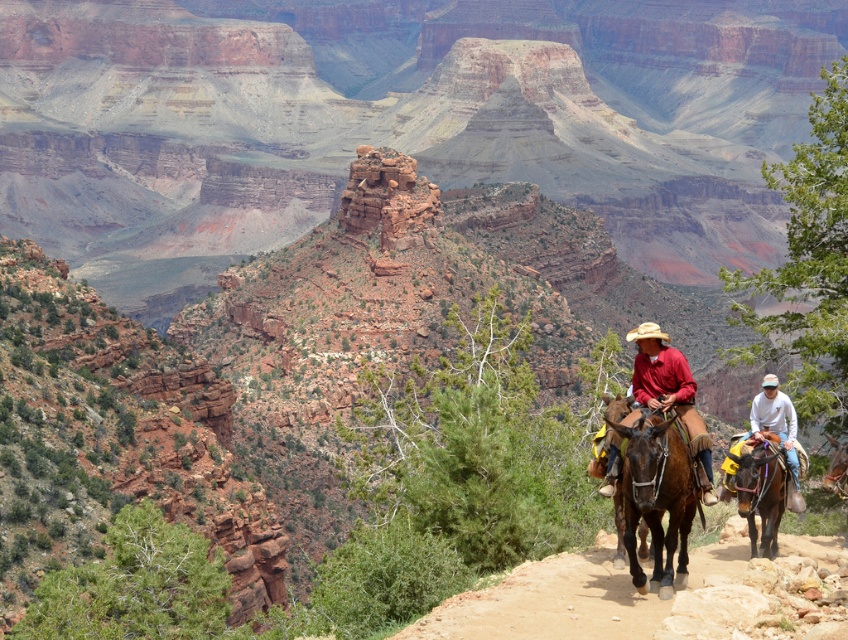
You are a photographer planning to take a portrait of both the matte red shirt at center and the white cotton shirt at upper right. Since you want to ensure both shirts are clearly visible, which one should you focus on first to capture their details properly?

The matte red shirt at center is larger in size than the white cotton shirt at upper right, so focusing on the matte red shirt at center first will help ensure its details are captured clearly before adjusting for the smaller white cotton shirt at upper right.

You are a photographer standing at the edge of the Grand Canyon. You see the brown glossy horse at center and the brown leather saddle at lower right in your viewfinder. Which object is closer to you, the photographer?

The brown glossy horse at center is closer to you because it is positioned in front of the brown leather saddle at lower right.